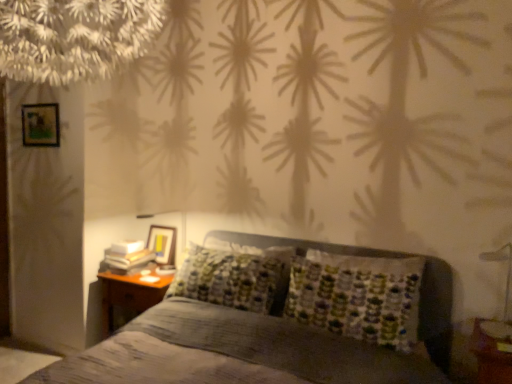
Question: From a real-world perspective, is textured gray bed at center positioned under metallic silver bedside lamp at lower right based on gravity?

Choices:
 (A) no
 (B) yes

Answer: (B)

Question: Considering the relative sizes of textured gray bed at center and metallic silver bedside lamp at lower right in the image provided, is textured gray bed at center thinner than metallic silver bedside lamp at lower right?

Choices:
 (A) yes
 (B) no

Answer: (B)

Question: Is textured gray bed at center turned away from metallic silver bedside lamp at lower right?

Choices:
 (A) yes
 (B) no

Answer: (B)

Question: Is textured gray bed at center at the right side of metallic silver bedside lamp at lower right?

Choices:
 (A) no
 (B) yes

Answer: (A)

Question: Is textured gray bed at center further to camera compared to metallic silver bedside lamp at lower right?

Choices:
 (A) yes
 (B) no

Answer: (B)

Question: Is textured gray bed at center wider or thinner than wooden glossy picture frame at upper left, the 2th picture frame viewed from the front?

Choices:
 (A) wide
 (B) thin

Answer: (A)

Question: From a real-world perspective, is textured gray bed at center physically located above or below wooden glossy picture frame at upper left, arranged as the 1th picture frame when ordered from the bottom?

Choices:
 (A) below
 (B) above

Answer: (A)

Question: Considering their positions, is textured gray bed at center located in front of or behind wooden glossy picture frame at upper left, the first picture frame positioned from the right?

Choices:
 (A) behind
 (B) front

Answer: (B)

Question: Is point (433, 349) closer or farther from the camera than point (166, 238)?

Choices:
 (A) closer
 (B) farther

Answer: (A)

Question: From their relative heights in the image, would you say wooden glossy picture frame at upper left, the 2th picture frame viewed from the front, is taller or shorter than metallic silver bedside lamp at lower right?

Choices:
 (A) short
 (B) tall

Answer: (A)

Question: Is wooden glossy picture frame at upper left, the second picture frame positioned from the left, bigger or smaller than metallic silver bedside lamp at lower right?

Choices:
 (A) big
 (B) small

Answer: (B)

Question: Is point (169, 259) positioned closer to the camera than point (494, 259)?

Choices:
 (A) farther
 (B) closer

Answer: (A)

Question: Considering their positions, is wooden glossy picture frame at upper left, the second picture frame positioned from the left, located in front of or behind metallic silver bedside lamp at lower right?

Choices:
 (A) behind
 (B) front

Answer: (A)

Question: Is wooden picture frame at upper left, acting as the first picture frame starting from the top, bigger or smaller than wooden glossy picture frame at upper left, acting as the 2th picture frame starting from the top?

Choices:
 (A) small
 (B) big

Answer: (A)

Question: Is wooden picture frame at upper left, the 2th picture frame when ordered from back to front, to the left or to the right of wooden glossy picture frame at upper left, the second picture frame positioned from the left, in the image?

Choices:
 (A) left
 (B) right

Answer: (A)